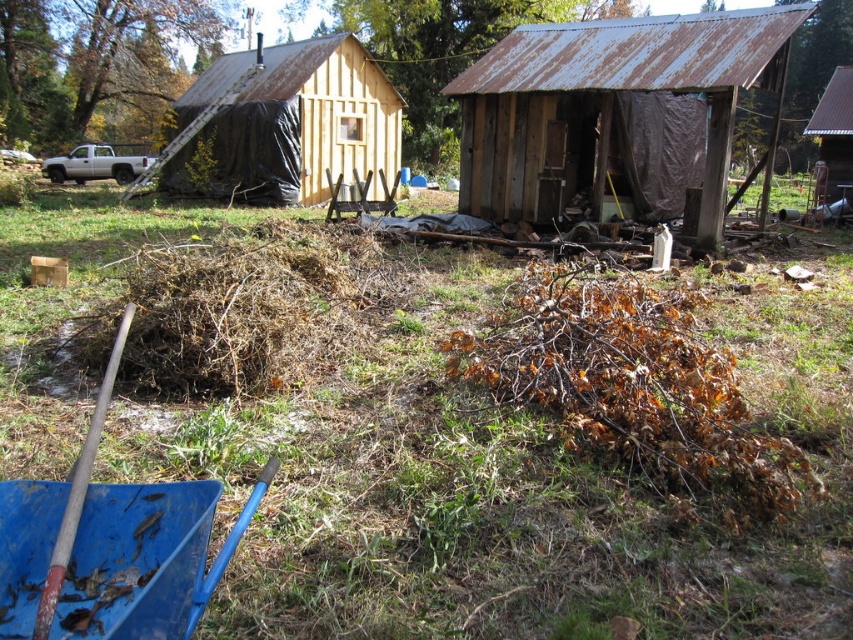
Between point (172, 202) and point (824, 93), which one is positioned in front?

Point (172, 202) is more forward.

How much distance is there between green grass at center and metallic corrugated roof at upper right?

green grass at center is 46.13 feet away from metallic corrugated roof at upper right.

At what (x,y) coordinates should I click in order to perform the action: click on green grass at center. Please return your answer as a coordinate pair (x, y). The width and height of the screenshot is (853, 640). Looking at the image, I should click on (502, 476).

You are a GUI agent. You are given a task and a screenshot of the screen. Output one action in this format:
    pyautogui.click(x=<x>, y=<y>)
    Task: Click on the green grass at center
    The height and width of the screenshot is (640, 853).
    Given the screenshot: What is the action you would take?
    (x=502, y=476)

Between point (389, 113) and point (85, 467), which one is positioned in front?

Point (85, 467)

Is wooden hut at center thinner than rusty metal shovel at lower left?

No, wooden hut at center is not thinner than rusty metal shovel at lower left.

The height and width of the screenshot is (640, 853). What are the coordinates of `wooden hut at center` in the screenshot? It's located at (294, 115).

Is green grass at center further to camera compared to rusty metal hut at center?

No, green grass at center is closer to the viewer.

Which is more to the right, green grass at center or rusty metal hut at center?

Positioned to the right is rusty metal hut at center.

Is point (340, 536) positioned after point (712, 90)?

That is False.

Identify the location of green grass at center. The height and width of the screenshot is (640, 853). (502, 476).